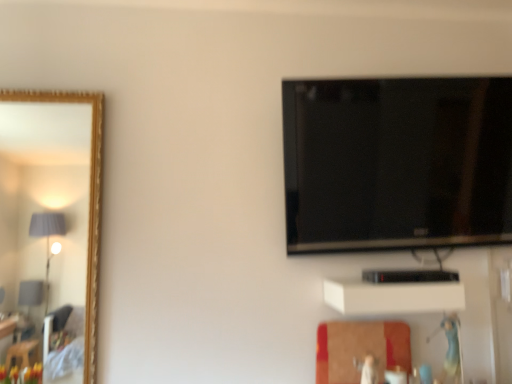
Question: Considering their positions, is white matte cabinet at lower center located in front of or behind black glossy tv at upper right?

Choices:
 (A) behind
 (B) front

Answer: (B)

Question: From the image's perspective, is white matte cabinet at lower center positioned above or below black glossy tv at upper right?

Choices:
 (A) below
 (B) above

Answer: (A)

Question: In terms of width, does white matte cabinet at lower center look wider or thinner when compared to black glossy tv at upper right?

Choices:
 (A) thin
 (B) wide

Answer: (B)

Question: From a real-world perspective, is black glossy tv at upper right positioned above or below white matte cabinet at lower center?

Choices:
 (A) below
 (B) above

Answer: (B)

Question: From the image's perspective, relative to white matte cabinet at lower center, is black glossy tv at upper right above or below?

Choices:
 (A) above
 (B) below

Answer: (A)

Question: Is black glossy tv at upper right to the left or to the right of white matte cabinet at lower center in the image?

Choices:
 (A) right
 (B) left

Answer: (A)

Question: In the image, is black glossy tv at upper right positioned in front of or behind white matte cabinet at lower center?

Choices:
 (A) front
 (B) behind

Answer: (B)